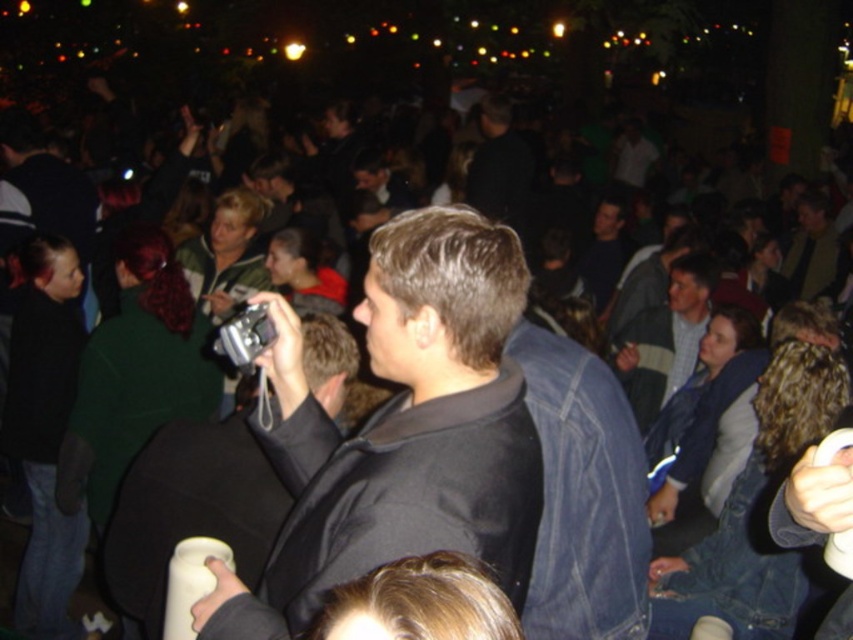
Question: Which of the following is the closest to the observer?

Choices:
 (A) (280, 436)
 (B) (672, 300)

Answer: (A)

Question: Which object is closer to the camera taking this photo?

Choices:
 (A) light gray sweater at center
 (B) dark blue shirt at center
 (C) black matte jacket at center

Answer: (C)

Question: Is light gray sweater at center bigger than dark blue shirt at center?

Choices:
 (A) no
 (B) yes

Answer: (A)

Question: From the image, what is the correct spatial relationship of black matte jacket at center in relation to light gray sweater at center?

Choices:
 (A) below
 (B) above

Answer: (A)

Question: Is black matte jacket at center to the left of dark blue shirt at center from the viewer's perspective?

Choices:
 (A) no
 (B) yes

Answer: (B)

Question: Which object appears closest to the camera in this image?

Choices:
 (A) light gray sweater at center
 (B) dark blue shirt at center

Answer: (A)